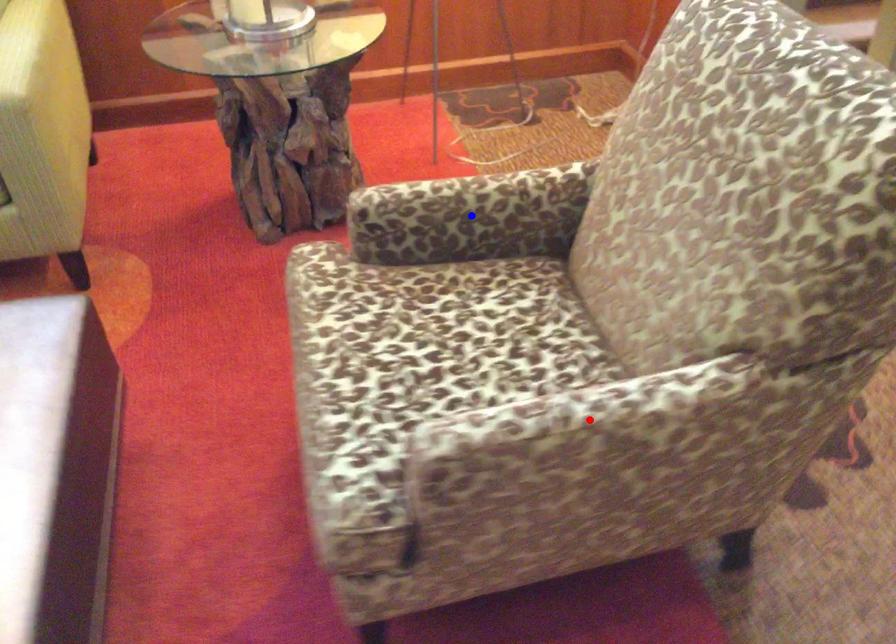
Question: Which of the two points in the image is closer to the camera?

Choices:
 (A) Blue point is closer.
 (B) Red point is closer.

Answer: (B)